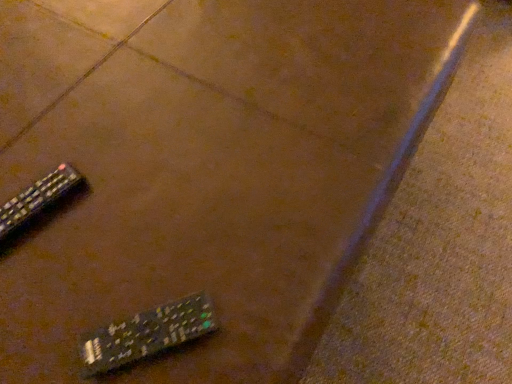
Find the location of a particular element. The image size is (512, 384). vacant area on the back side of black plastic remote at lower left, which appears as the first remote control when ordered from the bottom is located at coordinates (174, 209).